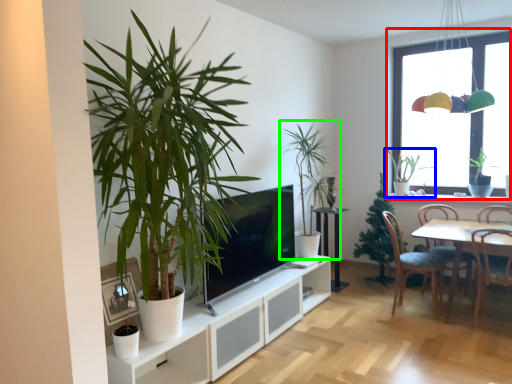
Question: Which object is positioned farthest from window (highlighted by a red box)? Select from houseplant (highlighted by a blue box) and houseplant (highlighted by a green box).

Choices:
 (A) houseplant
 (B) houseplant

Answer: (B)